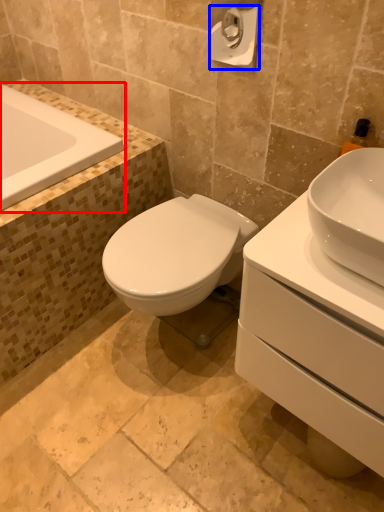
Question: Which of the following is the closest to the observer, bathtub (highlighted by a red box) or toilet paper (highlighted by a blue box)?

Choices:
 (A) bathtub
 (B) toilet paper

Answer: (B)